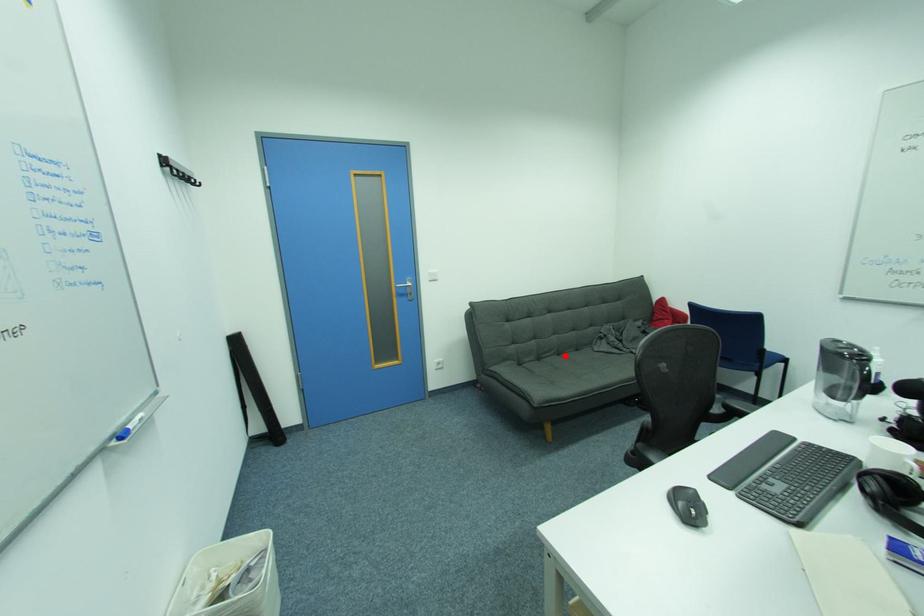
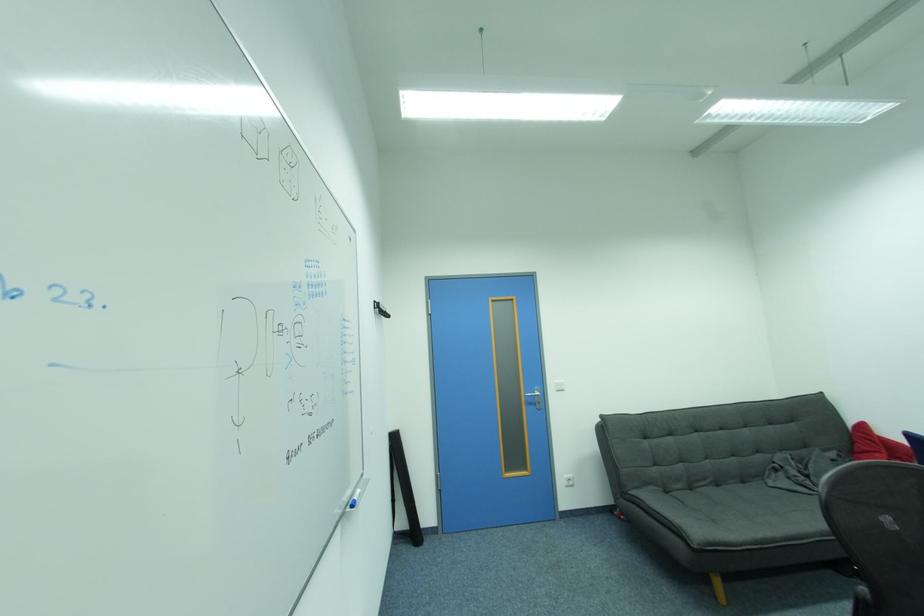
In the second image, find the point that corresponds to the highlighted location in the first image.

(723, 487)